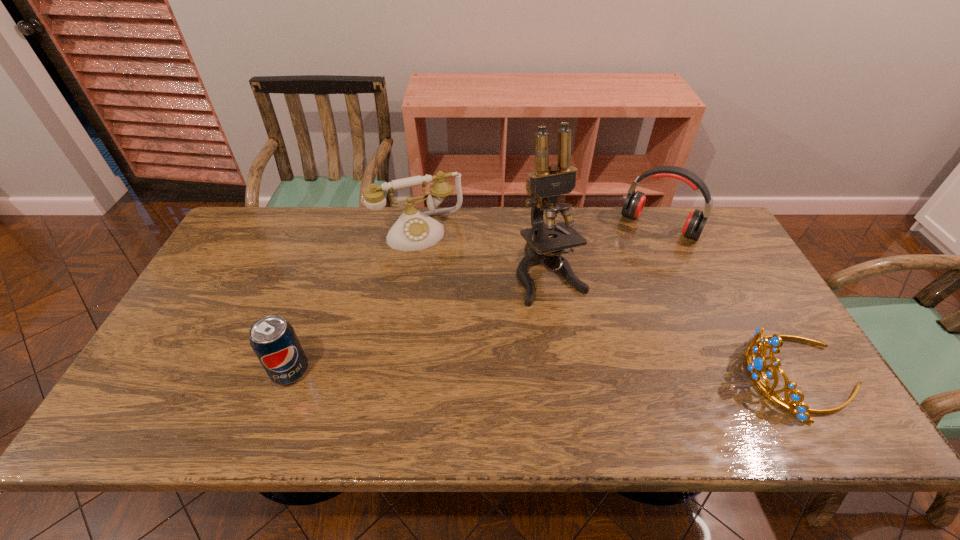
Where is `vacant space in between the third object from right to left and the earphone`? The width and height of the screenshot is (960, 540). vacant space in between the third object from right to left and the earphone is located at coordinates click(605, 250).

Locate an element on the screen. vacant space in between the soda can and the tallest object is located at coordinates (420, 323).

Find the location of `free spot between the tiara and the tallest object`. free spot between the tiara and the tallest object is located at coordinates (675, 326).

Where is `the second closest object to the earphone`? The image size is (960, 540). the second closest object to the earphone is located at coordinates (755, 369).

Point out which object is positioned as the third nearest to the tiara. Please provide its 2D coordinates. Your answer should be formatted as a tuple, i.e. [(x, y)], where the tuple contains the x and y coordinates of a point satisfying the conditions above.

[(414, 230)]

The height and width of the screenshot is (540, 960). Identify the location of vacant position in the image that satisfies the following two spatial constraints: 1. on the back side of the third object from left to right; 2. on the left side of the soda can. (324, 275).

Identify the location of blank area in the image that satisfies the following two spatial constraints: 1. on the back side of the third object from left to right; 2. on the left side of the soda can. (324, 275).

I want to click on vacant region that satisfies the following two spatial constraints: 1. on the back side of the earphone; 2. on the right side of the fourth object from right to left, so click(420, 226).

Image resolution: width=960 pixels, height=540 pixels. I want to click on vacant space that satisfies the following two spatial constraints: 1. on the back side of the earphone; 2. on the left side of the soda can, so click(x=342, y=226).